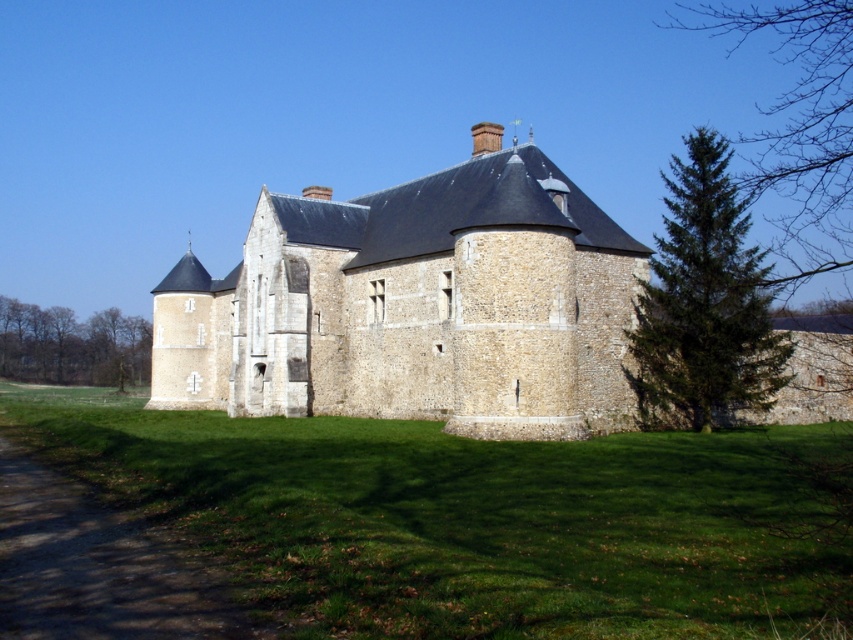
You are standing on the dirt path at left and want to walk towards the stone castle at center and the brown textured tree at left. Which object will you reach first?

You will reach the stone castle at center first because it is closer to the viewer than the brown textured tree at left.

You are standing at the base of the historic stone building and see two points marked on the image. Which point, point [480,324] or point [810,35], is closer to you?

Point [480,324] is closer to you because it is in front of point [810,35].

You are a tourist standing at the stone castle at center and want to reach the brown textured tree at left. The path is 60 meters long. Will you reach the tree before the path ends?

The distance between the stone castle at center and the brown textured tree at left is 66.60 meters, but the path is only 60 meters long. Therefore, you will not reach the tree before the path ends.